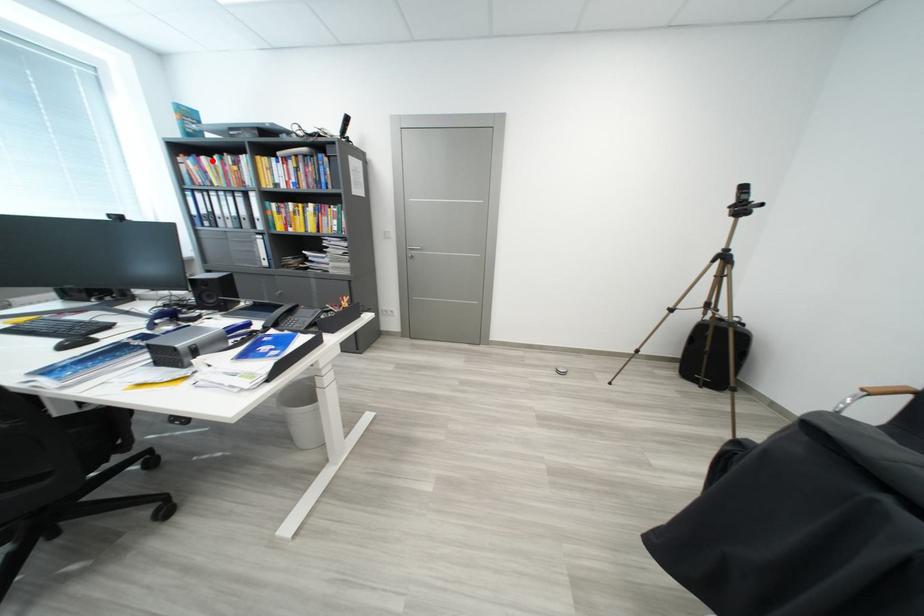
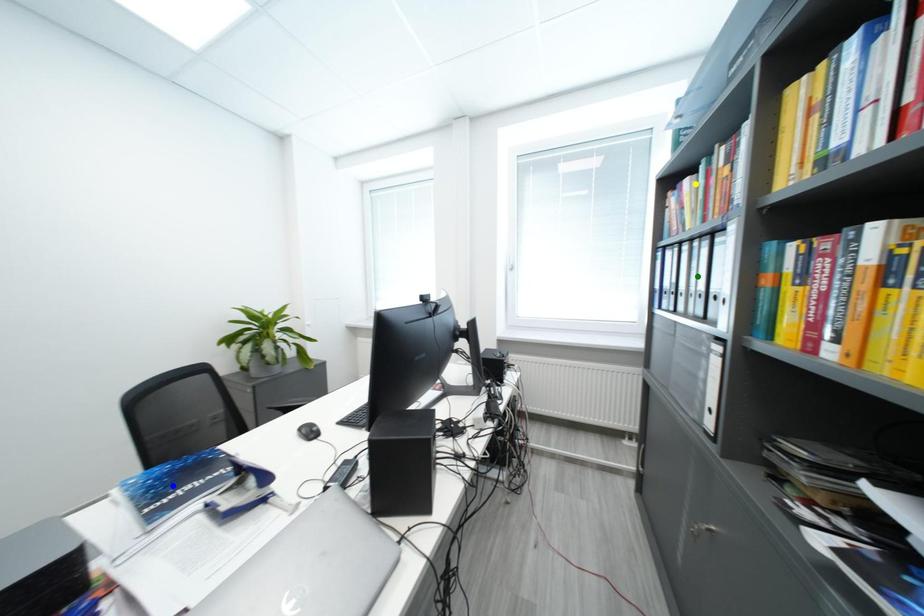
Question: I am providing you with two images of the same scene from different viewpoints. A red point is marked on the first image. You are given multiple points on the second image. Can you choose the point in image 2 that corresponds to the point in image 1?

Choices:
 (A) yellow point
 (B) blue point
 (C) green point

Answer: (A)